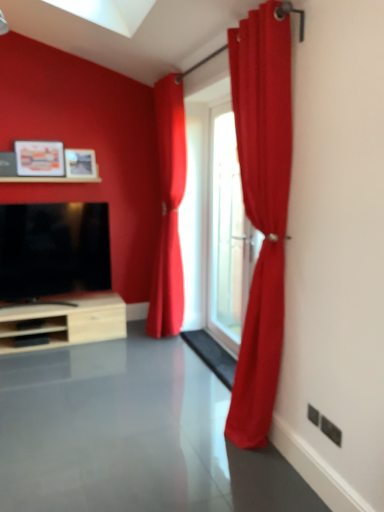
Find the location of a particular element. vacant space to the left of satin red curtain at right, acting as the 2th curtain starting from the left is located at coordinates (186, 429).